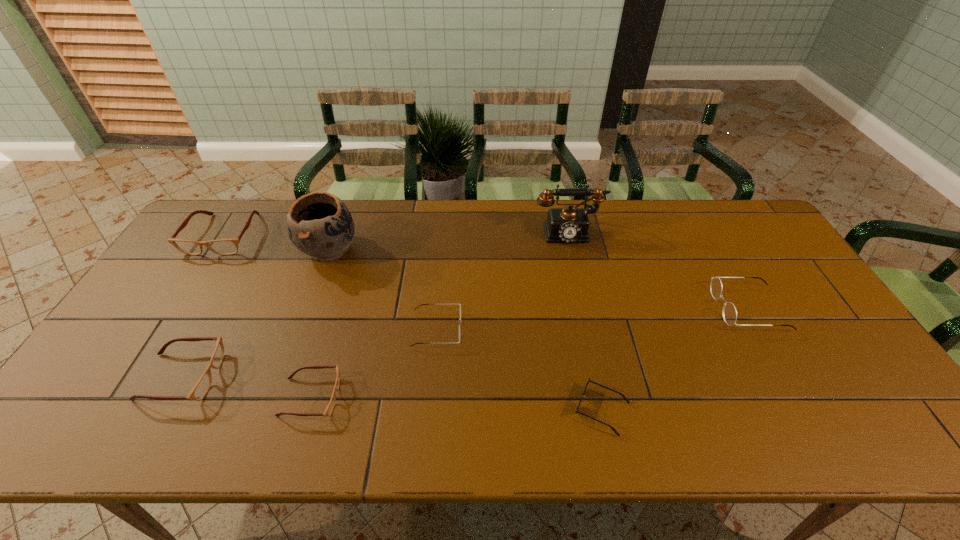
Where is `free spot between the biggest brown spectacles and the bigger black spectacles`? free spot between the biggest brown spectacles and the bigger black spectacles is located at coordinates (486, 272).

Where is `blank region between the second smallest brown spectacles and the smaller black spectacles`? blank region between the second smallest brown spectacles and the smaller black spectacles is located at coordinates (309, 353).

In order to click on empty space that is in between the farthest spectacles and the gray telephone in this screenshot , I will do `click(396, 233)`.

This screenshot has width=960, height=540. Find the location of `vacant point located between the pottery and the second shortest object`. vacant point located between the pottery and the second shortest object is located at coordinates (320, 323).

Where is `free space between the smaller black spectacles and the second smallest brown spectacles`? This screenshot has width=960, height=540. free space between the smaller black spectacles and the second smallest brown spectacles is located at coordinates (309, 353).

At what (x,y) coordinates should I click in order to perform the action: click on free point between the second biggest brown spectacles and the third spectacles from right to left. Please return your answer as a coordinate pair (x, y). The width and height of the screenshot is (960, 540). Looking at the image, I should click on (246, 387).

At what (x,y) coordinates should I click in order to perform the action: click on free space between the pottery and the fourth object from right to left. Please return your answer as a coordinate pair (x, y). The image size is (960, 540). Looking at the image, I should click on (383, 289).

The image size is (960, 540). I want to click on the fourth closest object to the gray telephone, so click(319, 224).

This screenshot has width=960, height=540. Identify the location of object that is the seventh closest to the second shortest object. (730, 313).

Point out which spectacles is positioned as the fourth nearest to the smallest brown spectacles. Please provide its 2D coordinates. Your answer should be formatted as a tuple, i.e. [(x, y)], where the tuple contains the x and y coordinates of a point satisfying the conditions above.

[(730, 313)]